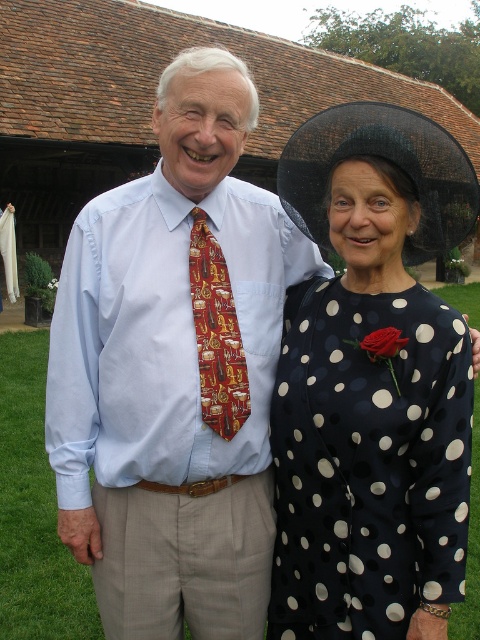
Does matte silk tie at center have a greater width compared to black dotted dress at center?

Indeed, matte silk tie at center has a greater width compared to black dotted dress at center.

Can you confirm if matte silk tie at center is positioned to the right of black dotted dress at center?

No, matte silk tie at center is not to the right of black dotted dress at center.

At what (x,y) coordinates should I click in order to perform the action: click on matte silk tie at center. Please return your answer as a coordinate pair (x, y). The width and height of the screenshot is (480, 640). Looking at the image, I should click on (175, 371).

Is point (199, 221) closer to viewer compared to point (381, 346)?

That is False.

Between red silk tie at center and matte red rose at upper right, which one has less height?

matte red rose at upper right

Where is `red silk tie at center`? red silk tie at center is located at coordinates (216, 333).

Does matte silk tie at center have a lesser height compared to red silk tie at center?

No.

Between matte silk tie at center and red silk tie at center, which one appears on the left side from the viewer's perspective?

matte silk tie at center is more to the left.

Is point (132, 410) farther from viewer compared to point (240, 419)?

No, it is not.

What are the coordinates of `matte silk tie at center` in the screenshot? It's located at (175, 371).